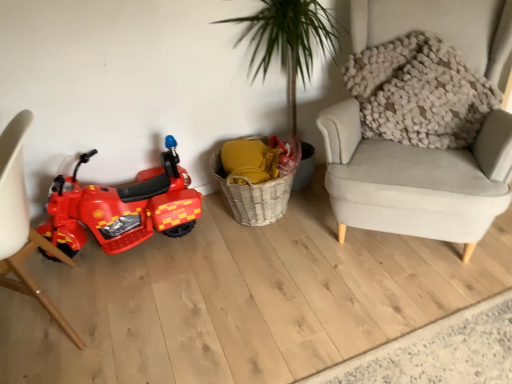
At what (x,y) coordinates should I click in order to perform the action: click on vacant space that is in between shiny plastic toy motorcycle at left and woven basket at center. Please return your answer as a coordinate pair (x, y). This screenshot has height=384, width=512. Looking at the image, I should click on (192, 239).